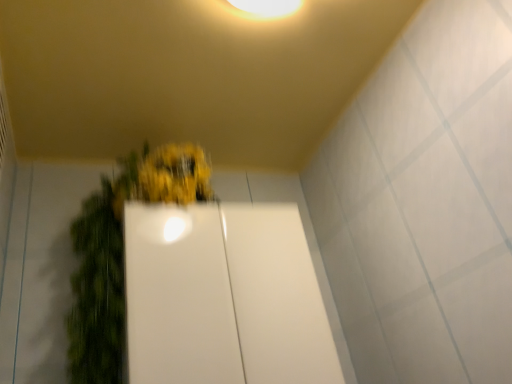
Measure the distance between point (172, 152) and camera.

They are 1.13 meters apart.

You are a GUI agent. You are given a task and a screenshot of the screen. Output one action in this format:
    pyautogui.click(x=<x>, y=<y>)
    Task: Click on the green matte plant at center
    This screenshot has width=512, height=384.
    Given the screenshot: What is the action you would take?
    pyautogui.click(x=120, y=252)

Measure the distance between green matte plant at center and camera.

The distance of green matte plant at center from camera is 36.34 inches.

What do you see at coordinates (120, 252) in the screenshot?
I see `green matte plant at center` at bounding box center [120, 252].

Where is `white glossy door at center`? The width and height of the screenshot is (512, 384). white glossy door at center is located at coordinates (224, 297).

Describe the element at coordinates (224, 297) in the screenshot. I see `white glossy door at center` at that location.

You are a GUI agent. You are given a task and a screenshot of the screen. Output one action in this format:
    pyautogui.click(x=<x>, y=<y>)
    Task: Click on the green matte plant at center
    
    Given the screenshot: What is the action you would take?
    pyautogui.click(x=120, y=252)

Considering the relative positions of green matte plant at center and white glossy door at center in the image provided, is green matte plant at center to the left or to the right of white glossy door at center?

green matte plant at center is to the left of white glossy door at center.

Is the position of green matte plant at center less distant than that of white glossy door at center?

That is True.

Is point (114, 318) positioned in front of point (294, 295)?

Yes, point (114, 318) is in front of point (294, 295).

From the image's perspective, is green matte plant at center on white glossy door at center?

Yes, from the image's perspective, green matte plant at center is above white glossy door at center.

From a real-world perspective, is green matte plant at center beneath white glossy door at center?

Actually, green matte plant at center is physically above white glossy door at center in the real world.

Considering the relative sizes of green matte plant at center and white glossy door at center in the image provided, is green matte plant at center wider than white glossy door at center?

Correct, the width of green matte plant at center exceeds that of white glossy door at center.

Is green matte plant at center taller or shorter than white glossy door at center?

Considering their sizes, green matte plant at center has more height than white glossy door at center.

Who is bigger, green matte plant at center or white glossy door at center?

Bigger between the two is green matte plant at center.

Is green matte plant at center situated inside white glossy door at center or outside?

green matte plant at center fits inside white glossy door at center.

Is green matte plant at center not close to white glossy door at center?

No, green matte plant at center is in close proximity to white glossy door at center.

Is green matte plant at center oriented towards white glossy door at center?

Yes, green matte plant at center faces towards white glossy door at center.

The image size is (512, 384). I want to click on houseplant on the left of white glossy door at center, so click(x=120, y=252).

Which is more to the right, white glossy door at center or green matte plant at center?

white glossy door at center.

Considering their positions, is white glossy door at center located in front of or behind green matte plant at center?

white glossy door at center is behind green matte plant at center.

Considering the points (320, 316) and (188, 188), which point is behind, point (320, 316) or point (188, 188)?

The point (188, 188) is behind.

From the image's perspective, between white glossy door at center and green matte plant at center, which one is located above?

green matte plant at center.

From a real-world perspective, who is located higher, white glossy door at center or green matte plant at center?

green matte plant at center.

Which object is thinner, white glossy door at center or green matte plant at center?

Thinner between the two is white glossy door at center.

Is white glossy door at center taller than green matte plant at center?

In fact, white glossy door at center may be shorter than green matte plant at center.

In the scene shown: Is white glossy door at center bigger than green matte plant at center?

No, white glossy door at center is not bigger than green matte plant at center.

Is green matte plant at center surrounded by white glossy door at center?

Yes, green matte plant at center can be found within white glossy door at center.

From the picture: Is white glossy door at center beside green matte plant at center?

white glossy door at center is not next to green matte plant at center, and they're not touching.

Is white glossy door at center aimed at green matte plant at center?

Yes, white glossy door at center is turned towards green matte plant at center.

How different are the orientations of white glossy door at center and green matte plant at center in degrees?

The angle between the facing direction of white glossy door at center and the facing direction of green matte plant at center is 3.36 degrees.

Image resolution: width=512 pixels, height=384 pixels. In order to click on glass door on the right of green matte plant at center in this screenshot , I will do `click(224, 297)`.

Find the location of a particular element. This screenshot has height=384, width=512. houseplant located on the left of white glossy door at center is located at coordinates (120, 252).

Locate an element on the screen. This screenshot has height=384, width=512. glass door behind the green matte plant at center is located at coordinates (224, 297).